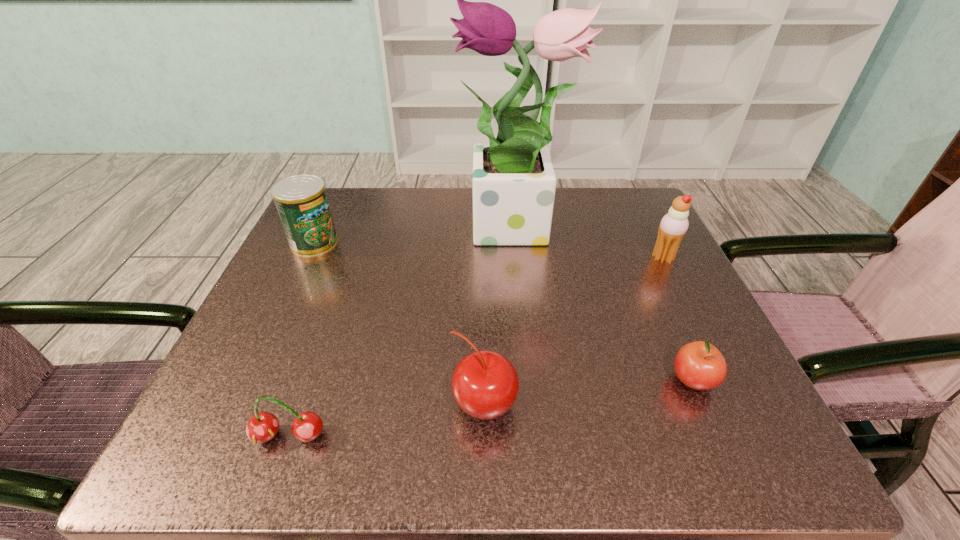
Identify the location of vacant space that satisfies the following two spatial constraints: 1. at the front with a straw on the icecream; 2. on the front side of the apple. pos(725,381).

The height and width of the screenshot is (540, 960). Find the location of `free space that satisfies the following two spatial constraints: 1. at the front with a straw on the icecream; 2. with stems pointing upwards on the left cherry`. free space that satisfies the following two spatial constraints: 1. at the front with a straw on the icecream; 2. with stems pointing upwards on the left cherry is located at coordinates (753, 436).

Where is `vacant space that satisfies the following two spatial constraints: 1. on the front-facing side of the flower arrangement; 2. on the left side of the apple`? The image size is (960, 540). vacant space that satisfies the following two spatial constraints: 1. on the front-facing side of the flower arrangement; 2. on the left side of the apple is located at coordinates (529, 381).

Identify the location of vacant area in the image that satisfies the following two spatial constraints: 1. on the back side of the third shortest object; 2. on the right side of the apple. (484, 381).